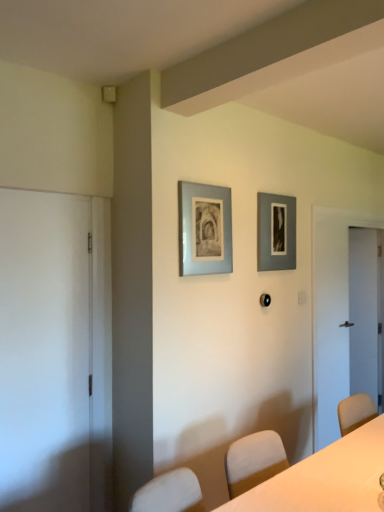
Question: Does white glossy table at center have a smaller size compared to matte gray picture frame at upper center, the 2th picture frame viewed from the left?

Choices:
 (A) no
 (B) yes

Answer: (A)

Question: Is white glossy table at center not within matte gray picture frame at upper center, placed as the first picture frame when sorted from right to left?

Choices:
 (A) yes
 (B) no

Answer: (A)

Question: From a real-world perspective, is white glossy table at center below matte gray picture frame at upper center, the 2th picture frame viewed from the left?

Choices:
 (A) yes
 (B) no

Answer: (A)

Question: Does white glossy table at center appear on the right side of matte gray picture frame at upper center, placed as the first picture frame when sorted from right to left?

Choices:
 (A) no
 (B) yes

Answer: (A)

Question: Does white glossy table at center come behind matte gray picture frame at upper center, placed as the first picture frame when sorted from right to left?

Choices:
 (A) no
 (B) yes

Answer: (A)

Question: Considering the positions of matte gray picture frame at upper center, which appears as the 2th picture frame when viewed from the front, and white matte door at left, which is the first door from front to back, in the image, is matte gray picture frame at upper center, which appears as the 2th picture frame when viewed from the front, wider or thinner than white matte door at left, which is the first door from front to back,?

Choices:
 (A) thin
 (B) wide

Answer: (A)

Question: In terms of height, does matte gray picture frame at upper center, which appears as the 2th picture frame when viewed from the front, look taller or shorter compared to white matte door at left, marked as the first door in a left-to-right arrangement?

Choices:
 (A) short
 (B) tall

Answer: (A)

Question: Is matte gray picture frame at upper center, the first picture frame when ordered from back to front, bigger or smaller than white matte door at left, the second door viewed from the back?

Choices:
 (A) small
 (B) big

Answer: (A)

Question: Is point click(x=274, y=214) closer or farther from the camera than point click(x=11, y=239)?

Choices:
 (A) farther
 (B) closer

Answer: (A)

Question: Considering the positions of point click(x=213, y=209) and point click(x=59, y=335), is point click(x=213, y=209) closer or farther from the camera than point click(x=59, y=335)?

Choices:
 (A) farther
 (B) closer

Answer: (A)

Question: From the image's perspective, is light blue matte picture frame at upper center, marked as the 2th picture frame in a back-to-front arrangement, located above or below white matte door at left, which is the first door from front to back?

Choices:
 (A) below
 (B) above

Answer: (B)

Question: In terms of width, does light blue matte picture frame at upper center, which is the second picture frame from right to left, look wider or thinner when compared to white matte door at left, marked as the first door in a left-to-right arrangement?

Choices:
 (A) thin
 (B) wide

Answer: (A)

Question: From a real-world perspective, relative to white matte door at left, marked as the first door in a left-to-right arrangement, is light blue matte picture frame at upper center, marked as the 2th picture frame in a back-to-front arrangement, vertically above or below?

Choices:
 (A) below
 (B) above

Answer: (B)

Question: In terms of height, does matte gray picture frame at upper center, which appears as the 2th picture frame when viewed from the front, look taller or shorter compared to white glossy table at center?

Choices:
 (A) short
 (B) tall

Answer: (B)

Question: From the image's perspective, is matte gray picture frame at upper center, placed as the first picture frame when sorted from right to left, positioned above or below white glossy table at center?

Choices:
 (A) above
 (B) below

Answer: (A)